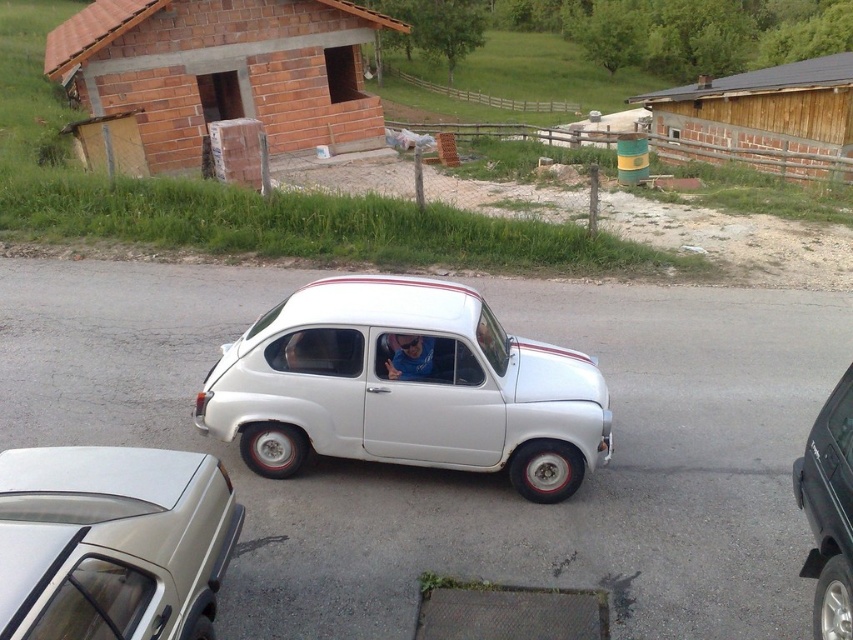
Describe the element at coordinates (112, 541) in the screenshot. I see `silver metallic sedan at lower left` at that location.

Is silver metallic sedan at lower left wider than black matte minivan at right?

Yes.

The height and width of the screenshot is (640, 853). Find the location of `silver metallic sedan at lower left`. silver metallic sedan at lower left is located at coordinates (112, 541).

Locate an element on the screen. silver metallic sedan at lower left is located at coordinates (112, 541).

Can you confirm if white matte car at center is positioned to the left of black matte minivan at right?

Indeed, white matte car at center is positioned on the left side of black matte minivan at right.

Does point (556, 369) lie behind point (839, 508)?

Yes, it is.

Find the location of a particular element. white matte car at center is located at coordinates (405, 387).

Between point (328, 298) and point (161, 145), which one is positioned behind?

The point (161, 145) is more distant.

Which is more to the right, white matte car at center or brick hut at upper left?

Positioned to the right is white matte car at center.

Which is behind, point (535, 417) or point (318, 70)?

The point (318, 70) is behind.

I want to click on white matte car at center, so click(405, 387).